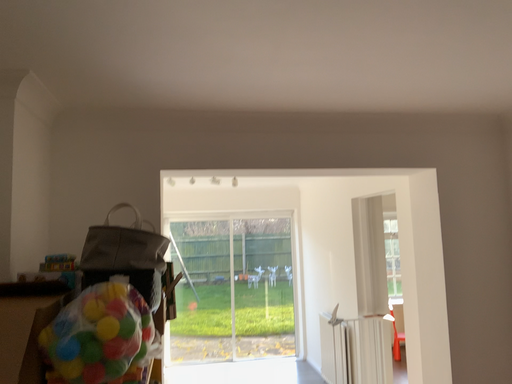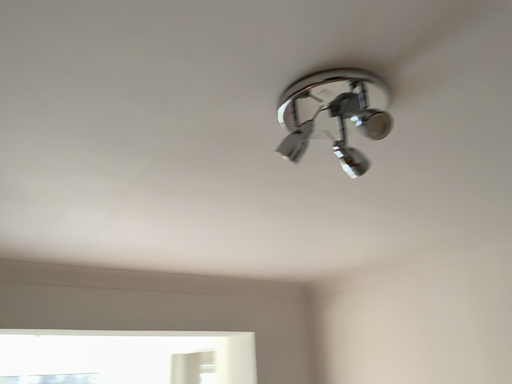
Question: Which way did the camera rotate in the video?

Choices:
 (A) rotated left
 (B) rotated right

Answer: (B)